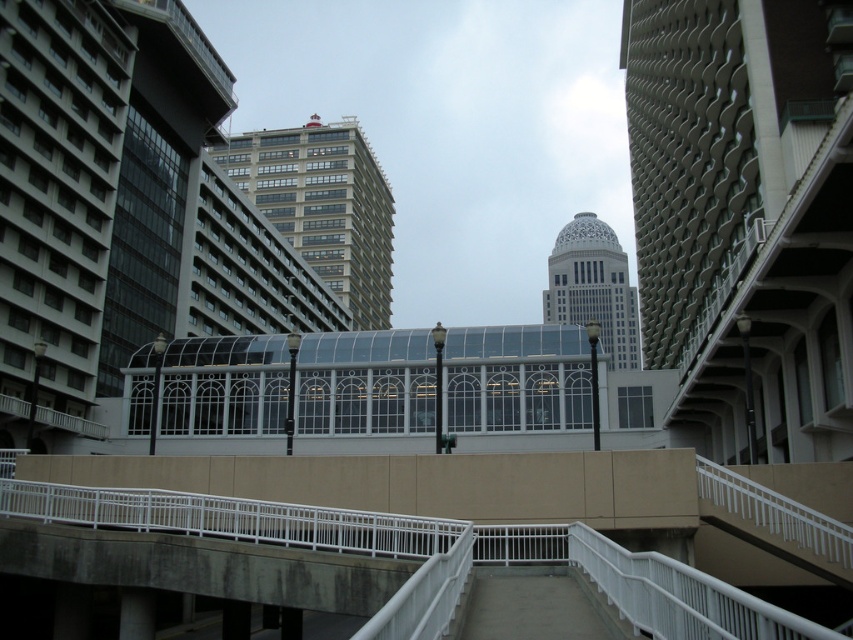
Question: Which point is closer to the camera?

Choices:
 (A) beige glass building at center
 (B) white marble tower at center

Answer: (A)

Question: Observing the image, what is the correct spatial positioning of beige glass building at center in reference to white marble tower at center?

Choices:
 (A) above
 (B) below

Answer: (A)

Question: Does beige glass building at center appear over white marble tower at center?

Choices:
 (A) yes
 (B) no

Answer: (A)

Question: Which point is closer to the camera taking this photo?

Choices:
 (A) (357, 147)
 (B) (585, 232)

Answer: (A)

Question: Is beige glass building at center to the right of white marble tower at center from the viewer's perspective?

Choices:
 (A) no
 (B) yes

Answer: (A)